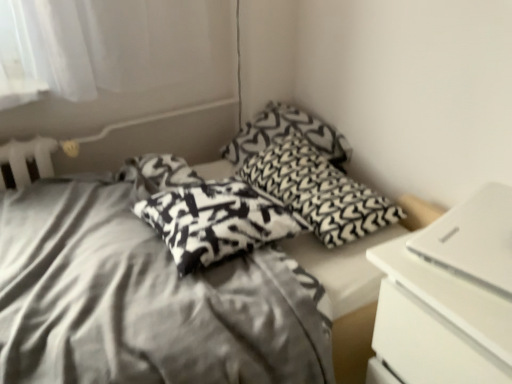
Question: In terms of size, does white matte laptop at right appear bigger or smaller than black knitted pillow at center, which is the 1th pillow in back-to-front order?

Choices:
 (A) small
 (B) big

Answer: (A)

Question: From a real-world perspective, relative to black knitted pillow at center, which is the 1th pillow in back-to-front order, is white matte laptop at right vertically above or below?

Choices:
 (A) above
 (B) below

Answer: (A)

Question: Based on their relative distances, which object is farther from the black knitted pillow at center, placed as the third pillow when sorted from front to back?

Choices:
 (A) black and white patterned pillow at center, the 2th pillow when ordered from front to back
 (B) silky fabric bed at center
 (C) black-and-white printed pillow at center, acting as the 1th pillow starting from the front
 (D) white matte laptop at right

Answer: (D)

Question: Considering the real-world distances, which object is farthest from the white matte laptop at right?

Choices:
 (A) black and white patterned pillow at center, the 2th pillow when ordered from front to back
 (B) black knitted pillow at center, which is the 1th pillow in back-to-front order
 (C) black-and-white printed pillow at center, the third pillow from the back
 (D) silky fabric bed at center

Answer: (B)